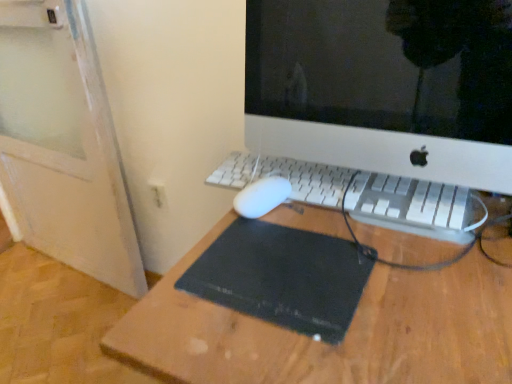
The height and width of the screenshot is (384, 512). Find the location of `free space above white plastic keyboard at center (from a real-world perspective)`. free space above white plastic keyboard at center (from a real-world perspective) is located at coordinates (332, 173).